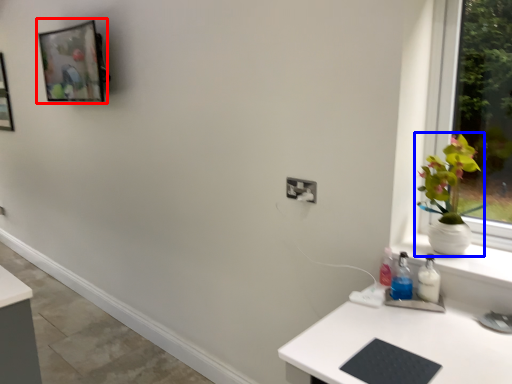
Question: Which object appears farthest to the camera in this image, picture frame (highlighted by a red box) or houseplant (highlighted by a blue box)?

Choices:
 (A) picture frame
 (B) houseplant

Answer: (A)